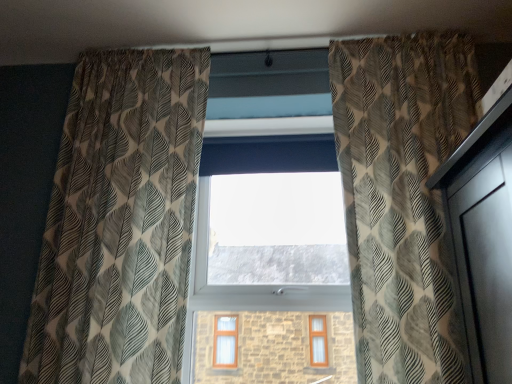
Question: Considering their positions, is transparent glass window at center located in front of or behind textured beige curtain at left, which is the first curtain in left-to-right order?

Choices:
 (A) behind
 (B) front

Answer: (A)

Question: Is transparent glass window at center situated inside textured beige curtain at left, which is the first curtain in left-to-right order, or outside?

Choices:
 (A) inside
 (B) outside

Answer: (B)

Question: Considering the real-world distances, which object is farthest from the printed fabric curtain at right, placed as the 1th curtain when sorted from right to left?

Choices:
 (A) textured beige curtain at left, which is the second curtain from right to left
 (B) transparent glass window at center

Answer: (A)

Question: Which of these objects is positioned closest to the textured beige curtain at left, which is the second curtain from right to left?

Choices:
 (A) printed fabric curtain at right, the 2th curtain positioned from the left
 (B) transparent glass window at center

Answer: (B)